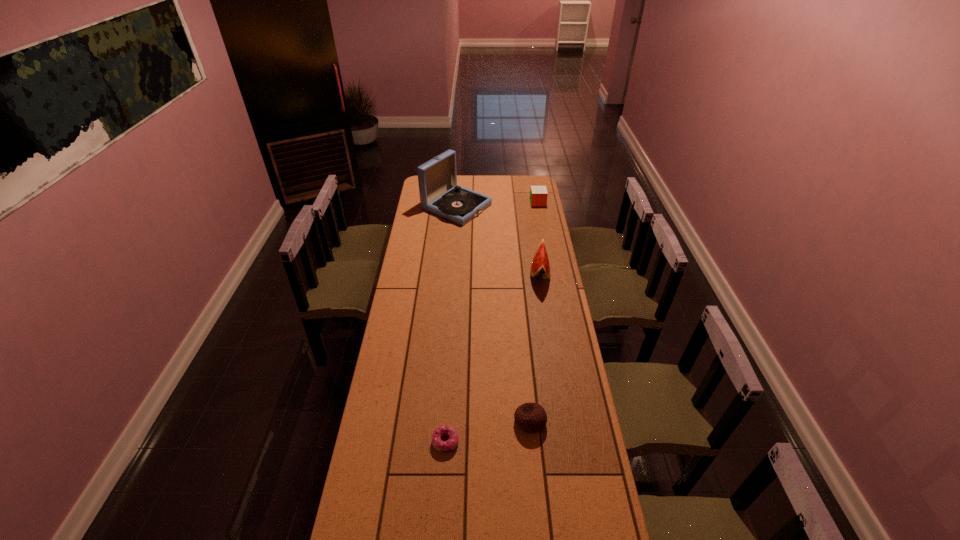
Locate an element on the screen. phonograph record is located at coordinates pos(439,193).

Where is `the third nearest object`? the third nearest object is located at coordinates (540, 268).

You are a GUI agent. You are given a task and a screenshot of the screen. Output one action in this format:
    pyautogui.click(x=<x>, y=<y>)
    Task: Click on the fourth shortest object
    This screenshot has width=960, height=540.
    Given the screenshot: What is the action you would take?
    pyautogui.click(x=540, y=268)

Where is `the third tallest object`? This screenshot has height=540, width=960. the third tallest object is located at coordinates (538, 194).

Identify the location of beanbag. The image size is (960, 540). (530, 417).

Image resolution: width=960 pixels, height=540 pixels. What are the coordinates of `the second shortest object` in the screenshot? It's located at click(530, 417).

Image resolution: width=960 pixels, height=540 pixels. Find the location of `the shortest object`. the shortest object is located at coordinates (442, 446).

You are a GUI agent. You are given a task and a screenshot of the screen. Output one action in this format:
    pyautogui.click(x=<x>, y=<y>)
    Task: Click on the vacant space situated 0.140m on the front of the phonograph record
    The width and height of the screenshot is (960, 540).
    Given the screenshot: What is the action you would take?
    pyautogui.click(x=454, y=241)

Find the location of a particular element. The width and height of the screenshot is (960, 540). vacant region located 0.050m on the outer rind of the watermelon is located at coordinates coord(519,272).

Locate an element on the screen. The image size is (960, 540). vacant space located on the outer rind of the watermelon is located at coordinates (512, 272).